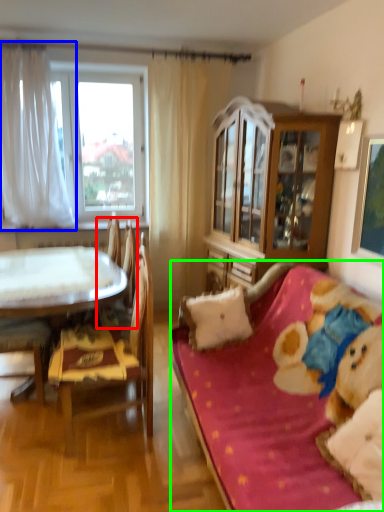
Question: Based on their relative distances, which object is nearer to armchair (highlighted by a red box)? Choose from curtain (highlighted by a blue box) and studio couch (highlighted by a green box).

Choices:
 (A) curtain
 (B) studio couch

Answer: (A)